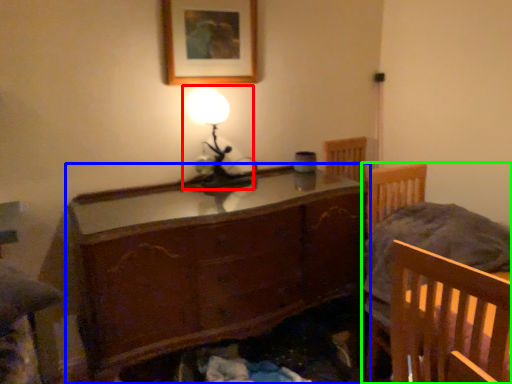
Question: Estimate the real-world distances between objects in this image. Which object is farther from table lamp (highlighted by a red box), chest of drawers (highlighted by a blue box) or furniture (highlighted by a green box)?

Choices:
 (A) chest of drawers
 (B) furniture

Answer: (B)